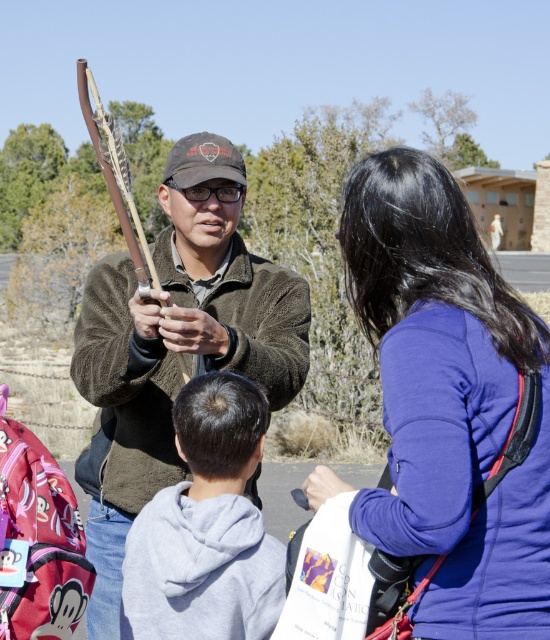
Based on the photo, is gray fleece hoodie at lower center to the left of wooden bow at center from the viewer's perspective?

Incorrect, gray fleece hoodie at lower center is not on the left side of wooden bow at center.

Who is shorter, gray fleece hoodie at lower center or wooden bow at center?

With less height is gray fleece hoodie at lower center.

Between point (246, 452) and point (116, 172), which one is positioned in front?

Positioned in front is point (246, 452).

At what (x,y) coordinates should I click in order to perform the action: click on gray fleece hoodie at lower center. Please return your answer as a coordinate pair (x, y). Image resolution: width=550 pixels, height=640 pixels. Looking at the image, I should click on (206, 528).

Which is in front, point (492, 611) or point (176, 458)?

Point (492, 611)

Does purple fleece jacket at upper right have a greater height compared to dark brown fuzzy jacket at center?

No, purple fleece jacket at upper right is not taller than dark brown fuzzy jacket at center.

Describe the element at coordinates (448, 401) in the screenshot. Image resolution: width=550 pixels, height=640 pixels. I see `purple fleece jacket at upper right` at that location.

You are a GUI agent. You are given a task and a screenshot of the screen. Output one action in this format:
    pyautogui.click(x=<x>, y=<y>)
    Task: Click on the purple fleece jacket at upper right
    The height and width of the screenshot is (640, 550).
    Given the screenshot: What is the action you would take?
    pyautogui.click(x=448, y=401)

Describe the element at coordinates (448, 401) in the screenshot. Image resolution: width=550 pixels, height=640 pixels. I see `purple fleece jacket at upper right` at that location.

Locate an element on the screen. Image resolution: width=550 pixels, height=640 pixels. purple fleece jacket at upper right is located at coordinates (448, 401).

Identify the location of purple fleece jacket at upper right. (448, 401).